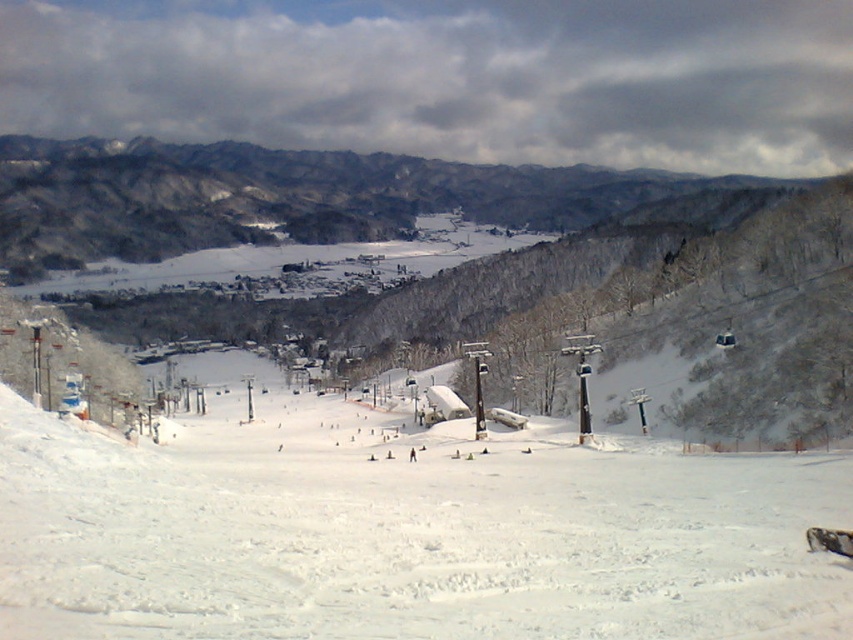
Question: Does white snow ski slope at center appear over white matte ski at center?

Choices:
 (A) yes
 (B) no

Answer: (B)

Question: Which point appears closest to the camera in this image?

Choices:
 (A) (843, 554)
 (B) (38, 458)

Answer: (A)

Question: Is white snow ski slope at center to the left of white matte ski at center from the viewer's perspective?

Choices:
 (A) no
 (B) yes

Answer: (B)

Question: Does white snow ski slope at center have a smaller size compared to white matte ski at center?

Choices:
 (A) no
 (B) yes

Answer: (A)

Question: Which point appears closest to the camera in this image?

Choices:
 (A) (428, 636)
 (B) (813, 532)

Answer: (A)